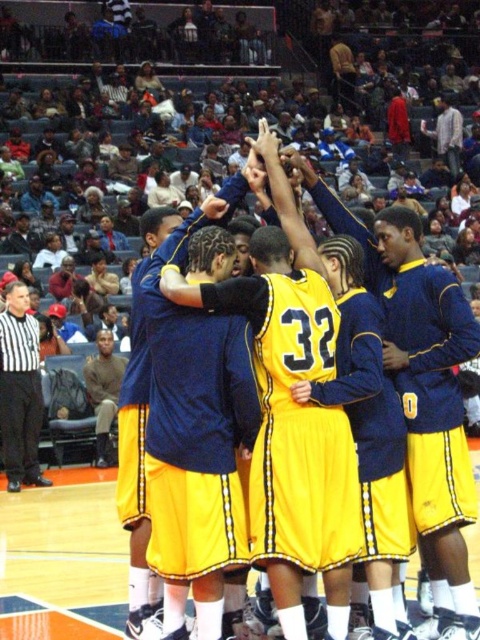
Which is below, yellow matte jersey at center or white shirt at left?

white shirt at left

Identify the location of yellow matte jersey at center. The height and width of the screenshot is (640, 480). (276, 374).

Identify the location of yellow matte jersey at center. (276, 374).

Does yellow shiny jersey at center have a smaller size compared to white shirt at left?

Indeed, yellow shiny jersey at center has a smaller size compared to white shirt at left.

What do you see at coordinates (297, 424) in the screenshot? The height and width of the screenshot is (640, 480). I see `yellow shiny jersey at center` at bounding box center [297, 424].

Locate an element on the screen. This screenshot has width=480, height=640. yellow shiny jersey at center is located at coordinates (297, 424).

Is point (317, 436) more distant than point (303, 486)?

Yes.

Which is behind, point (325, 340) or point (298, 509)?

The point (325, 340) is more distant.

Locate an element on the screen. Image resolution: width=480 pixels, height=640 pixels. yellow matte jersey at center is located at coordinates (276, 374).